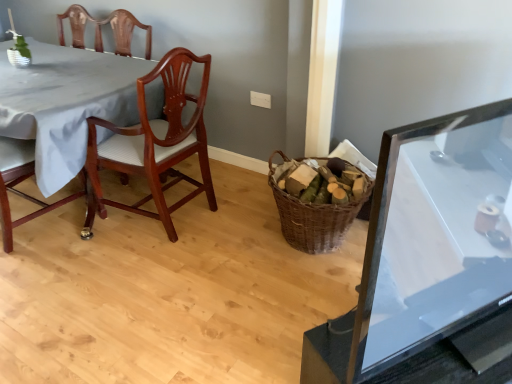
What do you see at coordinates (153, 145) in the screenshot? This screenshot has width=512, height=384. I see `mahogany wood chair at left, which is the 2th chair in left-to-right order` at bounding box center [153, 145].

The width and height of the screenshot is (512, 384). What do you see at coordinates (435, 236) in the screenshot?
I see `transparent glass table at right, which ranks as the 2th table in left-to-right order` at bounding box center [435, 236].

I want to click on white fabric table at left, which ranks as the second table in right-to-left order, so click(65, 103).

Is woven brown basket at center not within mahogany wood chair at left, which ranks as the 1th chair in right-to-left order?

Yes, woven brown basket at center is located beyond the bounds of mahogany wood chair at left, which ranks as the 1th chair in right-to-left order.

Is point (314, 157) less distant than point (152, 169)?

That is False.

Is woven brown basket at center shorter than mahogany wood chair at left, which ranks as the 1th chair in right-to-left order?

Indeed, woven brown basket at center has a lesser height compared to mahogany wood chair at left, which ranks as the 1th chair in right-to-left order.

Is transparent glass table at right, the first table in the front-to-back sequence, taller or shorter than mahogany wood chair at left, which is counted as the 1th chair, starting from the left?

Considering their sizes, transparent glass table at right, the first table in the front-to-back sequence, has less height than mahogany wood chair at left, which is counted as the 1th chair, starting from the left.

Is transparent glass table at right, the first table in the front-to-back sequence, looking in the opposite direction of mahogany wood chair at left, which is counted as the 1th chair, starting from the left?

That's not correct — transparent glass table at right, the first table in the front-to-back sequence, is not looking away from mahogany wood chair at left, which is counted as the 1th chair, starting from the left.

Can you confirm if transparent glass table at right, which is counted as the 2th table, starting from the back, is positioned to the left of mahogany wood chair at left, which is counted as the 1th chair, starting from the left?

No, transparent glass table at right, which is counted as the 2th table, starting from the back, is not to the left of mahogany wood chair at left, which is counted as the 1th chair, starting from the left.

Is transparent glass table at right, which is counted as the 2th table, starting from the back, far from mahogany wood chair at left, which is counted as the 1th chair, starting from the left?

transparent glass table at right, which is counted as the 2th table, starting from the back, is far away from mahogany wood chair at left, which is counted as the 1th chair, starting from the left.

In the image, is mahogany wood chair at left, which is counted as the 1th chair, starting from the left, on the left side or the right side of woven brown basket at center?

Clearly, mahogany wood chair at left, which is counted as the 1th chair, starting from the left, is on the left of woven brown basket at center in the image.

From the image's perspective, would you say mahogany wood chair at left, the second chair in the right-to-left sequence, is shown under woven brown basket at center?

No, from the image's perspective, mahogany wood chair at left, the second chair in the right-to-left sequence, is not beneath woven brown basket at center.

From their relative heights in the image, would you say mahogany wood chair at left, which is counted as the 1th chair, starting from the left, is taller or shorter than woven brown basket at center?

Clearly, mahogany wood chair at left, which is counted as the 1th chair, starting from the left, is taller compared to woven brown basket at center.

Is mahogany wood chair at left, which is counted as the 1th chair, starting from the left, far away from woven brown basket at center?

Yes.

Who is more distant, transparent glass table at right, placed as the first table when sorted from right to left, or mahogany wood chair at left, which is the 2th chair in left-to-right order?

mahogany wood chair at left, which is the 2th chair in left-to-right order.

Does point (396, 211) appear closer or farther from the camera than point (84, 232)?

Point (396, 211).

Based on their sizes in the image, would you say transparent glass table at right, which ranks as the 2th table in left-to-right order, is bigger or smaller than mahogany wood chair at left, which is the 2th chair in left-to-right order?

transparent glass table at right, which ranks as the 2th table in left-to-right order, is smaller than mahogany wood chair at left, which is the 2th chair in left-to-right order.

From the image's perspective, is transparent glass table at right, which ranks as the 2th table in left-to-right order, beneath white fabric table at left, which ranks as the second table in right-to-left order?

Yes, from the image's perspective, transparent glass table at right, which ranks as the 2th table in left-to-right order, is below white fabric table at left, which ranks as the second table in right-to-left order.

Measure the distance between transparent glass table at right, which is counted as the 2th table, starting from the back, and white fabric table at left, the 2th table from the front.

A distance of 1.71 meters exists between transparent glass table at right, which is counted as the 2th table, starting from the back, and white fabric table at left, the 2th table from the front.

Is point (424, 213) closer or farther from the camera than point (113, 69)?

Clearly, point (424, 213) is closer to the camera than point (113, 69).

Can white fabric table at left, the 2th table from the front, be found inside transparent glass table at right, placed as the first table when sorted from right to left?

No, transparent glass table at right, placed as the first table when sorted from right to left, does not contain white fabric table at left, the 2th table from the front.

Who is shorter, mahogany wood chair at left, which ranks as the 1th chair in right-to-left order, or transparent glass table at right, which is counted as the 2th table, starting from the back?

With less height is transparent glass table at right, which is counted as the 2th table, starting from the back.

Considering the points (199, 107) and (431, 334), which point is behind, point (199, 107) or point (431, 334)?

Point (199, 107)

Would you say mahogany wood chair at left, which is the 2th chair in left-to-right order, is outside transparent glass table at right, which is counted as the 2th table, starting from the back?

Yes, mahogany wood chair at left, which is the 2th chair in left-to-right order, is not within transparent glass table at right, which is counted as the 2th table, starting from the back.

How many degrees apart are the facing directions of mahogany wood chair at left, which ranks as the 1th chair in right-to-left order, and transparent glass table at right, which is counted as the 2th table, starting from the back?

mahogany wood chair at left, which ranks as the 1th chair in right-to-left order, and transparent glass table at right, which is counted as the 2th table, starting from the back, are facing 151 degrees away from each other.

Which object is wider, mahogany wood chair at left, the second chair in the right-to-left sequence, or white fabric table at left, the 2th table from the front?

Wider between the two is white fabric table at left, the 2th table from the front.

Locate an element on the screen. This screenshot has width=512, height=384. table that is the 1st one above the mahogany wood chair at left, the second chair in the right-to-left sequence (from a real-world perspective) is located at coordinates (65, 103).

Is mahogany wood chair at left, which is counted as the 1th chair, starting from the left, oriented towards white fabric table at left, which ranks as the second table in right-to-left order?

Yes, mahogany wood chair at left, which is counted as the 1th chair, starting from the left, is oriented towards white fabric table at left, which ranks as the second table in right-to-left order.

Considering the positions of points (0, 196) and (123, 73), is point (0, 196) closer to camera compared to point (123, 73)?

Yes, point (0, 196) is closer to viewer.

At what (x,y) coordinates should I click in order to perform the action: click on the 1st chair positioned above the woven brown basket at center (from a real-world perspective). Please return your answer as a coordinate pair (x, y). Looking at the image, I should click on (153, 145).

Image resolution: width=512 pixels, height=384 pixels. I want to click on the 2nd chair to the left when counting from the transparent glass table at right, the first table in the front-to-back sequence, so click(x=20, y=182).

Looking at the image, which one is located further to white fabric table at left, positioned as the first table in left-to-right order, mahogany wood chair at left, which is counted as the 1th chair, starting from the left, or woven brown basket at center?

woven brown basket at center lies further to white fabric table at left, positioned as the first table in left-to-right order, than the other object.

Looking at the image, which one is located closer to mahogany wood chair at left, which is counted as the 1th chair, starting from the left, mahogany wood chair at left, which ranks as the 1th chair in right-to-left order, or transparent glass table at right, which is counted as the 2th table, starting from the back?

mahogany wood chair at left, which ranks as the 1th chair in right-to-left order, is positioned closer to the anchor mahogany wood chair at left, which is counted as the 1th chair, starting from the left.

Based on their spatial positions, is mahogany wood chair at left, which is counted as the 1th chair, starting from the left, or mahogany wood chair at left, which is the 2th chair in left-to-right order, further from transparent glass table at right, placed as the first table when sorted from right to left?

mahogany wood chair at left, which is counted as the 1th chair, starting from the left.

Estimate the real-world distances between objects in this image. Which object is further from woven brown basket at center, white fabric table at left, which ranks as the second table in right-to-left order, or transparent glass table at right, which ranks as the 2th table in left-to-right order?

The object further to woven brown basket at center is white fabric table at left, which ranks as the second table in right-to-left order.

Estimate the real-world distances between objects in this image. Which object is further from woven brown basket at center, transparent glass table at right, the first table in the front-to-back sequence, or mahogany wood chair at left, which ranks as the 1th chair in right-to-left order?

Based on the image, transparent glass table at right, the first table in the front-to-back sequence, appears to be further to woven brown basket at center.

When comparing their distances from mahogany wood chair at left, the second chair in the right-to-left sequence, does white fabric table at left, positioned as the first table in left-to-right order, or transparent glass table at right, which is counted as the 2th table, starting from the back, seem further?

transparent glass table at right, which is counted as the 2th table, starting from the back, is positioned further to the anchor mahogany wood chair at left, the second chair in the right-to-left sequence.

Looking at the image, which one is located closer to transparent glass table at right, placed as the first table when sorted from right to left, white fabric table at left, positioned as the first table in left-to-right order, or mahogany wood chair at left, the second chair in the right-to-left sequence?

white fabric table at left, positioned as the first table in left-to-right order, lies closer to transparent glass table at right, placed as the first table when sorted from right to left, than the other object.

Based on their spatial positions, is white fabric table at left, the 2th table from the front, or mahogany wood chair at left, which is counted as the 1th chair, starting from the left, closer to mahogany wood chair at left, which is the 2th chair in left-to-right order?

white fabric table at left, the 2th table from the front, is positioned closer to the anchor mahogany wood chair at left, which is the 2th chair in left-to-right order.

What are the coordinates of `chair between mahogany wood chair at left, the second chair in the right-to-left sequence, and transparent glass table at right, which is counted as the 2th table, starting from the back, from left to right` in the screenshot? It's located at (153, 145).

The height and width of the screenshot is (384, 512). Identify the location of chair between mahogany wood chair at left, the second chair in the right-to-left sequence, and woven brown basket at center, in the horizontal direction. (153, 145).

At what (x,y) coordinates should I click in order to perform the action: click on chair situated between white fabric table at left, the 2th table from the front, and woven brown basket at center from left to right. Please return your answer as a coordinate pair (x, y). The width and height of the screenshot is (512, 384). Looking at the image, I should click on click(x=153, y=145).

The width and height of the screenshot is (512, 384). I want to click on table between mahogany wood chair at left, the second chair in the right-to-left sequence, and transparent glass table at right, which is counted as the 2th table, starting from the back, in the horizontal direction, so click(x=65, y=103).